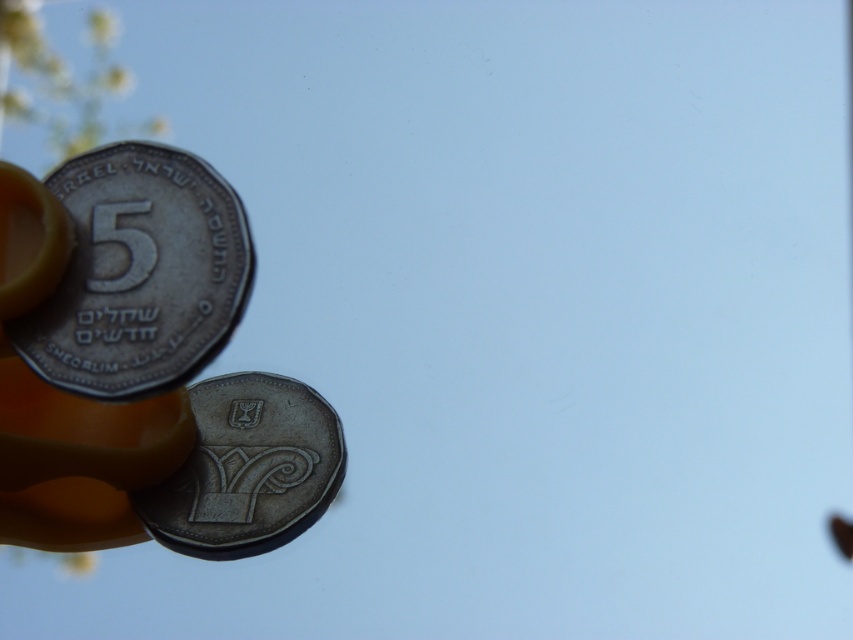
You are holding two coins between your fingers. The silver metallic coin at upper left and the shiny silver coin at center. Which coin is closer to your eyes?

The silver metallic coin at upper left is closer to the viewer than the shiny silver coin at center.

You are holding two Israeli coins between your fingers. The silver metallic coin at upper left is represented by point (138, 273). Which coin is closer to the top edge of your hand?

The silver metallic coin at upper left represented by point (138, 273) is closer to the top edge of your hand.

You are a coin collector examining two coins in your hand. You notice the silver metallic coin at upper left and the shiny silver coin at center. Which coin is thinner?

The silver metallic coin at upper left is thinner than the shiny silver coin at center according to the description.